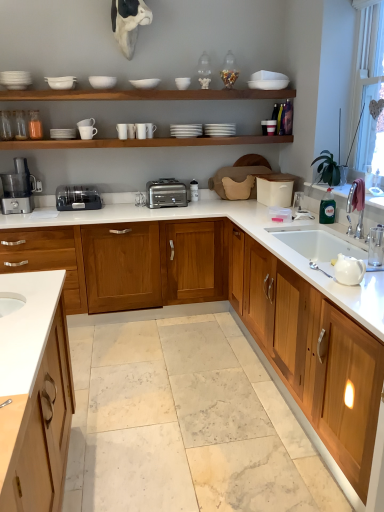
What is the approximate height of metallic silver coffee machine at left?

metallic silver coffee machine at left is 17.32 inches tall.

What is the approximate height of white glossy teapot at right?

white glossy teapot at right is 4.98 inches in height.

At what (x,y) coordinates should I click in order to perform the action: click on satin black toaster at center, which is the second appliance from right to left. Please return your answer as a coordinate pair (x, y). The image size is (384, 512). Looking at the image, I should click on (78, 198).

Which is behind, point (29, 194) or point (348, 267)?

The point (29, 194) is behind.

Is metallic silver coffee machine at left taller than white glossy teapot at right?

Yes, metallic silver coffee machine at left is taller than white glossy teapot at right.

From a real-world perspective, which is physically above, metallic silver coffee machine at left or white glossy teapot at right?

metallic silver coffee machine at left is physically above.

This screenshot has width=384, height=512. In order to click on tea pot on the right of metallic silver coffee machine at left in this screenshot , I will do `click(349, 270)`.

From the image's perspective, between satin black toaster at center, placed as the first appliance when sorted from front to back, and transparent plastic window screen at upper right, who is located below?

satin black toaster at center, placed as the first appliance when sorted from front to back, is shown below in the image.

Is satin black toaster at center, the first appliance positioned from the left, with transparent plastic window screen at upper right?

There is a gap between satin black toaster at center, the first appliance positioned from the left, and transparent plastic window screen at upper right.

Visually, is satin black toaster at center, the 2th appliance from the back, positioned to the left or to the right of transparent plastic window screen at upper right?

From the image, it's evident that satin black toaster at center, the 2th appliance from the back, is to the left of transparent plastic window screen at upper right.

From a real-world perspective, who is located higher, white glossy countertop at center, the second countertop from the bottom, or metallic silver coffee machine at left?

metallic silver coffee machine at left, from a real-world perspective.

From their relative heights in the image, would you say white glossy countertop at center, the 1th countertop from the top, is taller or shorter than metallic silver coffee machine at left?

Considering their sizes, white glossy countertop at center, the 1th countertop from the top, has more height than metallic silver coffee machine at left.

Which is more to the right, white glossy countertop at center, the second countertop from the bottom, or metallic silver coffee machine at left?

From the viewer's perspective, white glossy countertop at center, the second countertop from the bottom, appears more on the right side.

Is white glossy countertop at center, the 1th countertop from the top, inside or outside of metallic silver coffee machine at left?

white glossy countertop at center, the 1th countertop from the top, is located beyond the bounds of metallic silver coffee machine at left.

From the picture: Considering the sizes of transparent plastic window screen at upper right and white matte shelf at upper center in the image, is transparent plastic window screen at upper right bigger or smaller than white matte shelf at upper center?

Clearly, transparent plastic window screen at upper right is larger in size than white matte shelf at upper center.

Can you confirm if transparent plastic window screen at upper right is positioned to the right of white matte shelf at upper center?

Indeed, transparent plastic window screen at upper right is positioned on the right side of white matte shelf at upper center.

Where is `shelf behind the transparent plastic window screen at upper right`? This screenshot has width=384, height=512. shelf behind the transparent plastic window screen at upper right is located at coordinates (145, 95).

Consider the image. Does transparent plastic window screen at upper right have a lesser height compared to white matte shelf at upper center?

No.

The image size is (384, 512). I want to click on toaster that appears below the white matte shelf at upper center (from the image's perspective), so click(166, 193).

Is white matte shelf at upper center further to the viewer compared to satin silver toaster at center?

That is False.

Considering the sizes of objects white matte shelf at upper center and satin silver toaster at center in the image provided, who is shorter, white matte shelf at upper center or satin silver toaster at center?

Standing shorter between the two is white matte shelf at upper center.

Is white matte shelf at upper center at the right side of satin silver toaster at center?

In fact, white matte shelf at upper center is to the left of satin silver toaster at center.

Is white glossy countertop at center, the 1th countertop from the top, at the left side of white matte shelf at upper center?

Yes.

Is white glossy countertop at center, the second countertop from the bottom, not within white matte shelf at upper center?

Yes, white glossy countertop at center, the second countertop from the bottom, is located beyond the bounds of white matte shelf at upper center.

From a real-world perspective, which object stands above the other?

white matte shelf at upper center, from a real-world perspective.

How different are the orientations of white glossy countertop at center, the 1th countertop from the top, and white matte shelf at upper center in degrees?

The angular difference between white glossy countertop at center, the 1th countertop from the top, and white matte shelf at upper center is 0.528 degrees.

Looking at this image, between white glossy teapot at right and satin black toaster at center, which is the second appliance from right to left, which one has smaller size?

With smaller size is white glossy teapot at right.

Between white glossy teapot at right and satin black toaster at center, the first appliance positioned from the left, which one appears on the right side from the viewer's perspective?

white glossy teapot at right is more to the right.

Does point (358, 265) come behind point (56, 205)?

No, (358, 265) is closer to viewer.

Locate an element on the screen. tea pot below the satin black toaster at center, the first appliance positioned from the left (from a real-world perspective) is located at coordinates (349, 270).

The width and height of the screenshot is (384, 512). Find the location of `tea pot below the metallic silver coffee machine at left (from the image's perspective)`. tea pot below the metallic silver coffee machine at left (from the image's perspective) is located at coordinates (349, 270).

You are a GUI agent. You are given a task and a screenshot of the screen. Output one action in this format:
    pyautogui.click(x=<x>, y=<y>)
    Task: Click on the window screen on the right of the satin black toaster at center, which is the second appliance from right to left
    This screenshot has height=512, width=384.
    Given the screenshot: What is the action you would take?
    pyautogui.click(x=369, y=91)

Looking at the image, which one is located closer to white glossy teapot at right, transparent plastic window screen at upper right or white glossy countertop at center, the second countertop from the bottom?

white glossy countertop at center, the second countertop from the bottom, is closer to white glossy teapot at right.

When comparing their distances from white glossy teapot at right, does white marble countertop at center, which is the 1th countertop from bottom to top, or white glossy countertop at center, the second countertop from the bottom, seem further?

white glossy countertop at center, the second countertop from the bottom, is positioned further to the anchor white glossy teapot at right.

Which object lies further to the anchor point satin silver toaster at center, white glossy teapot at right or white matte shelf at upper center?

white glossy teapot at right.

When comparing their distances from transparent plastic window screen at upper right, does satin silver toaster at center or satin black toaster at center, the 2th appliance from the back, seem closer?

satin silver toaster at center lies closer to transparent plastic window screen at upper right than the other object.

Which object lies nearer to the anchor point satin silver toaster at center, satin silver toaster at center, which ranks as the 1th appliance in back-to-front order, or wooden cabinet at right?

satin silver toaster at center, which ranks as the 1th appliance in back-to-front order, is positioned closer to the anchor satin silver toaster at center.

From the image, which object appears to be farther from satin silver toaster at center, which ranks as the 1th appliance in back-to-front order, white marble countertop at center, which is the 1th countertop from bottom to top, or satin black toaster at center, which is the second appliance from right to left?

Among the two, white marble countertop at center, which is the 1th countertop from bottom to top, is located further to satin silver toaster at center, which ranks as the 1th appliance in back-to-front order.

Considering their positions, is satin silver toaster at center positioned further to wooden cabinet at right than white marble countertop at center, which is the 1th countertop from bottom to top?

satin silver toaster at center is further to wooden cabinet at right.

When comparing their distances from satin silver toaster at center, which is the 2th appliance from front to back, does white glossy teapot at right or metallic silver coffee machine at left seem closer?

The object closer to satin silver toaster at center, which is the 2th appliance from front to back, is metallic silver coffee machine at left.

Locate an element on the screen. Image resolution: width=384 pixels, height=512 pixels. shelf between metallic silver coffee machine at left and satin silver toaster at center, which ranks as the 1th appliance in back-to-front order, in the horizontal direction is located at coordinates (145, 95).

You are a GUI agent. You are given a task and a screenshot of the screen. Output one action in this format:
    pyautogui.click(x=<x>, y=<y>)
    Task: Click on the window screen located between white glossy teapot at right and satin silver toaster at center, the 2th appliance from the left, in the depth direction
    This screenshot has height=512, width=384.
    Given the screenshot: What is the action you would take?
    pyautogui.click(x=369, y=91)

You are a GUI agent. You are given a task and a screenshot of the screen. Output one action in this format:
    pyautogui.click(x=<x>, y=<y>)
    Task: Click on the countertop located between satin black toaster at center, the first appliance positioned from the left, and satin silver toaster at center in the left-right direction
    The height and width of the screenshot is (512, 384).
    Given the screenshot: What is the action you would take?
    pyautogui.click(x=238, y=226)

Find the location of a particular element. The width and height of the screenshot is (384, 512). window screen between wooden cabinet at right and satin silver toaster at center, which is the 2th appliance from front to back, along the z-axis is located at coordinates (369, 91).